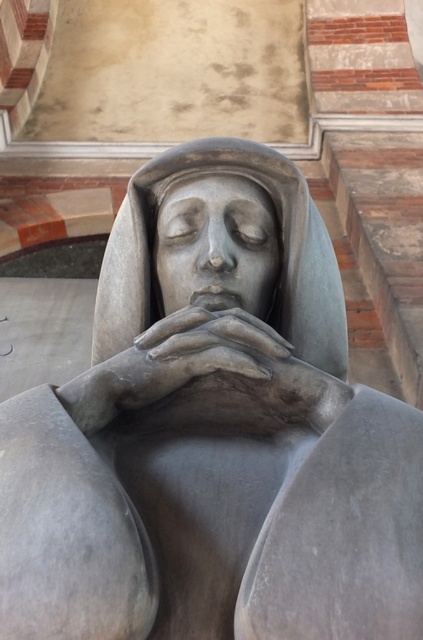
You are an art conservator examining the statue. You notice that the satin gray statue at center and the matte gray hands at center are both part of the same sculpture. Which object is placed above the other?

The satin gray statue at center is positioned over the matte gray hands at center.

You are an art conservator examining the statue. You need to clean the matte gray hands at center and the matte gray sculpture at center. Which object should you clean first if you want to start with the part closest to you?

The matte gray hands at center should be cleaned first because they are positioned in front of the matte gray sculpture at center, making them closer to the observer.

You are an art conservator examining the statue. You need to determine if the matte gray hands at center are positioned lower than the top of the satin gray statue at center. Based on the description, can you confirm this?

Result: The satin gray statue at center is taller than matte gray hands at center, so yes, the matte gray hands at center are positioned lower than the top of the satin gray statue at center.